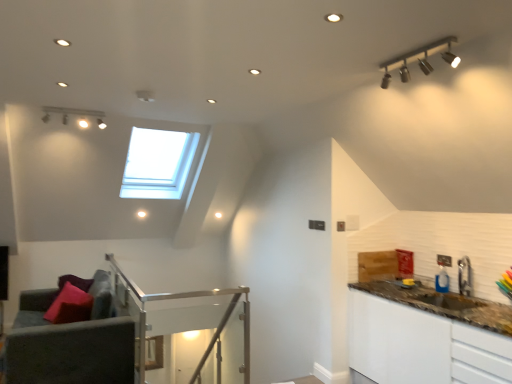
Question: Is velvet grey armchair at lower left shorter than metallic silver faucet at right?

Choices:
 (A) yes
 (B) no

Answer: (B)

Question: Is the position of velvet grey armchair at lower left less distant than that of metallic silver faucet at right?

Choices:
 (A) no
 (B) yes

Answer: (B)

Question: Is the depth of velvet grey armchair at lower left greater than that of metallic silver faucet at right?

Choices:
 (A) no
 (B) yes

Answer: (A)

Question: From a real-world perspective, does velvet grey armchair at lower left sit lower than metallic silver faucet at right?

Choices:
 (A) no
 (B) yes

Answer: (B)

Question: Could metallic silver faucet at right be considered to be inside velvet grey armchair at lower left?

Choices:
 (A) yes
 (B) no

Answer: (B)

Question: Considering their positions, is brown granite countertop at right located in front of or behind matte pink pillow at lower left?

Choices:
 (A) front
 (B) behind

Answer: (A)

Question: Is brown granite countertop at right inside or outside of matte pink pillow at lower left?

Choices:
 (A) outside
 (B) inside

Answer: (A)

Question: From the image's perspective, is brown granite countertop at right located above or below matte pink pillow at lower left?

Choices:
 (A) below
 (B) above

Answer: (A)

Question: Does point (459, 359) appear closer or farther from the camera than point (73, 312)?

Choices:
 (A) closer
 (B) farther

Answer: (A)

Question: From the image's perspective, relative to brown granite countertop at right, is clear glass balustrade at center above or below?

Choices:
 (A) below
 (B) above

Answer: (B)

Question: Which is correct: clear glass balustrade at center is inside brown granite countertop at right, or outside of it?

Choices:
 (A) inside
 (B) outside

Answer: (B)

Question: Is clear glass balustrade at center in front of or behind brown granite countertop at right in the image?

Choices:
 (A) front
 (B) behind

Answer: (B)

Question: Is clear glass balustrade at center wider or thinner than brown granite countertop at right?

Choices:
 (A) thin
 (B) wide

Answer: (A)

Question: Is point pos(367,259) positioned closer to the camera than point pos(104,311)?

Choices:
 (A) farther
 (B) closer

Answer: (A)

Question: Is brown granite countertop at right situated inside velvet purple couch at lower left or outside?

Choices:
 (A) inside
 (B) outside

Answer: (B)